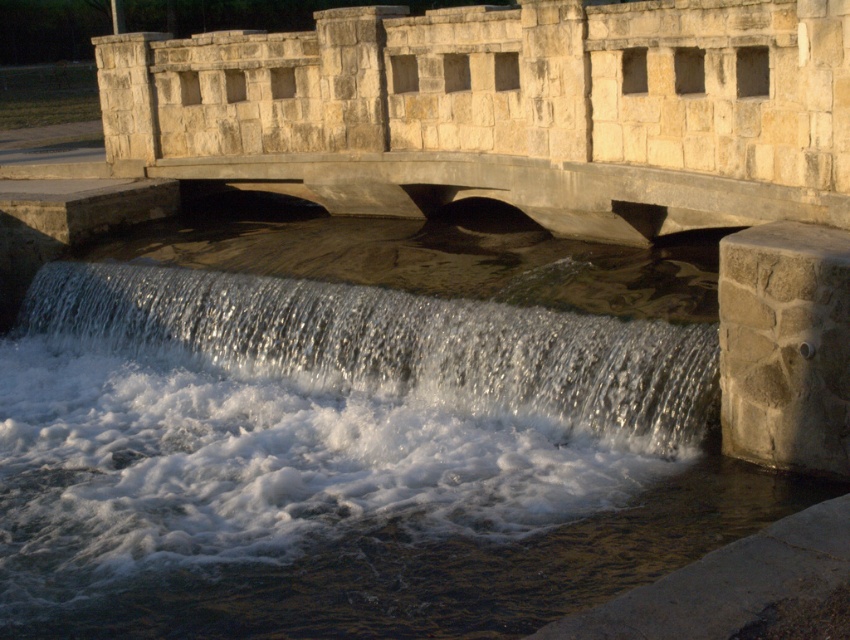
Is stone bridge at center above gray stone/rough at lower right?

Yes.

Identify the location of stone bridge at center. The height and width of the screenshot is (640, 850). (507, 109).

This screenshot has height=640, width=850. What are the coordinates of `stone bridge at center` in the screenshot? It's located at (507, 109).

Is clear water at center to the right of gray stone/rough at lower right from the viewer's perspective?

No, clear water at center is not to the right of gray stone/rough at lower right.

Which is behind, point (629, 445) or point (843, 417)?

The point (629, 445) is more distant.

Is point (442, 362) positioned after point (796, 387)?

Yes, point (442, 362) is behind point (796, 387).

Image resolution: width=850 pixels, height=640 pixels. Identify the location of clear water at center. (395, 348).

Measure the distance between stone bridge at center and camera.

stone bridge at center and camera are 11.21 meters apart from each other.

Does stone bridge at center have a smaller size compared to clear water at center?

No.

The width and height of the screenshot is (850, 640). I want to click on stone bridge at center, so (x=507, y=109).

This screenshot has width=850, height=640. I want to click on stone bridge at center, so click(x=507, y=109).